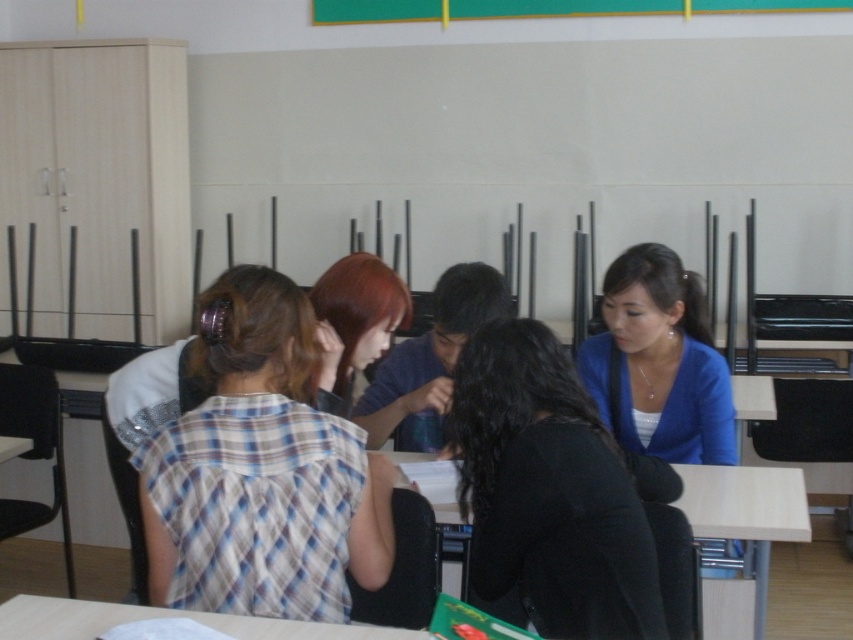
Who is more forward, (331, 419) or (595, 552)?

Positioned in front is point (595, 552).

At what (x,y) coordinates should I click in order to perform the action: click on plaid fabric shirt at center. Please return your answer as a coordinate pair (x, y). Image resolution: width=853 pixels, height=640 pixels. Looking at the image, I should click on (263, 468).

Between blue matte cardigan at center and green matte board at upper center, which one has more height?

blue matte cardigan at center is taller.

Who is positioned more to the right, blue matte cardigan at center or green matte board at upper center?

blue matte cardigan at center

The image size is (853, 640). Describe the element at coordinates (660, 362) in the screenshot. I see `blue matte cardigan at center` at that location.

You are a GUI agent. You are given a task and a screenshot of the screen. Output one action in this format:
    pyautogui.click(x=<x>, y=<y>)
    Task: Click on the blue matte cardigan at center
    The width and height of the screenshot is (853, 640).
    Given the screenshot: What is the action you would take?
    pyautogui.click(x=660, y=362)

Which is above, black matte jacket at center or blue matte cardigan at center?

blue matte cardigan at center

Does black matte jacket at center have a smaller size compared to blue matte cardigan at center?

No.

This screenshot has height=640, width=853. I want to click on black matte jacket at center, so click(549, 492).